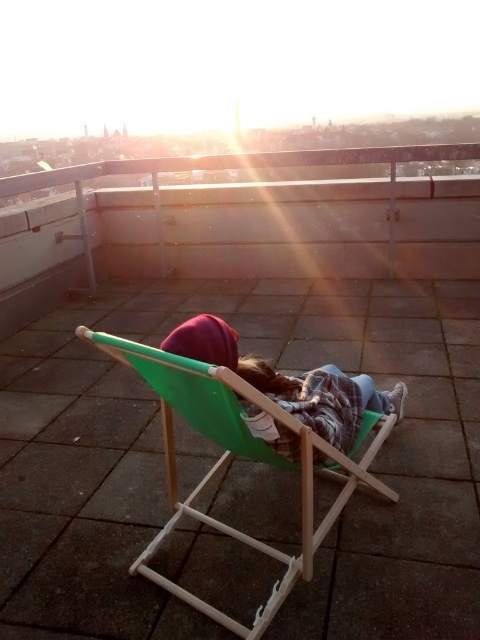
Question: Does green wood beach chair at center appear on the right side of matte green chair at center?

Choices:
 (A) yes
 (B) no

Answer: (B)

Question: Which point is farther to the camera?

Choices:
 (A) (334, 506)
 (B) (328, 378)

Answer: (B)

Question: Is the position of green wood beach chair at center more distant than that of matte green chair at center?

Choices:
 (A) no
 (B) yes

Answer: (A)

Question: Which object appears farthest from the camera in this image?

Choices:
 (A) green wood beach chair at center
 (B) matte green chair at center

Answer: (B)

Question: Is green wood beach chair at center above matte green chair at center?

Choices:
 (A) yes
 (B) no

Answer: (B)